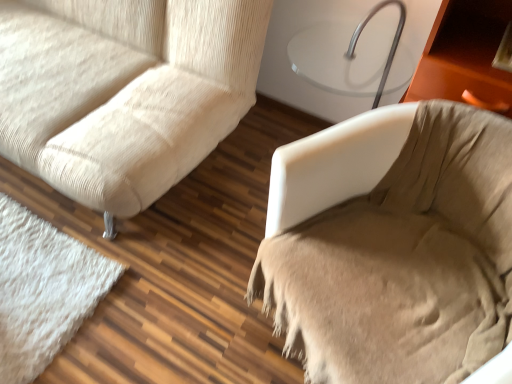
Locate an element on the screen. The height and width of the screenshot is (384, 512). beige fabric chair at right is located at coordinates (392, 245).

Describe the element at coordinates (392, 245) in the screenshot. The image size is (512, 384). I see `beige fabric chair at right` at that location.

Measure the distance between beige fabric chair at right and camera.

→ beige fabric chair at right and camera are 35.04 inches apart from each other.

Measure the distance between beige textured fabric couch at left and camera.

beige textured fabric couch at left and camera are 1.15 meters apart.

Identify the location of beige textured fabric couch at left. Image resolution: width=512 pixels, height=384 pixels. (124, 91).

What do you see at coordinates (124, 91) in the screenshot? The width and height of the screenshot is (512, 384). I see `beige textured fabric couch at left` at bounding box center [124, 91].

Locate an element on the screen. Image resolution: width=512 pixels, height=384 pixels. beige fabric chair at right is located at coordinates coord(392,245).

Which object is positioned more to the left, beige textured fabric couch at left or beige fabric chair at right?

beige textured fabric couch at left is more to the left.

Is the depth of beige textured fabric couch at left less than that of beige fabric chair at right?

No.

Which is closer to the camera, (23, 21) or (276, 320)?

The point (276, 320) is closer to the camera.

From the image's perspective, is beige textured fabric couch at left below beige fabric chair at right?

Incorrect, from the image's perspective, beige textured fabric couch at left is higher than beige fabric chair at right.

From a real-world perspective, which is physically above, beige textured fabric couch at left or beige fabric chair at right?

beige textured fabric couch at left, from a real-world perspective.

Consider the image. Between beige textured fabric couch at left and beige fabric chair at right, which one has smaller width?

→ Thinner between the two is beige fabric chair at right.

Does beige textured fabric couch at left have a lesser height compared to beige fabric chair at right?

No.

Can you confirm if beige textured fabric couch at left is smaller than beige fabric chair at right?

No, beige textured fabric couch at left is not smaller than beige fabric chair at right.

Do you think beige textured fabric couch at left is within beige fabric chair at right, or outside of it?

beige textured fabric couch at left is outside beige fabric chair at right.

Based on the photo, is beige textured fabric couch at left far from beige fabric chair at right?

No, beige textured fabric couch at left is not far away from beige fabric chair at right.

Is beige fabric chair at right at the back of beige textured fabric couch at left?

No, beige textured fabric couch at left is not facing away from beige fabric chair at right.

What are the coordinates of `furniture that appears below the beige textured fabric couch at left (from the image's perspective)` in the screenshot? It's located at (392, 245).

Which is more to the right, beige fabric chair at right or beige textured fabric couch at left?

From the viewer's perspective, beige fabric chair at right appears more on the right side.

Is beige fabric chair at right closer to the viewer compared to beige textured fabric couch at left?

Yes, beige fabric chair at right is in front of beige textured fabric couch at left.

Which is behind, point (497, 182) or point (14, 16)?

The point (14, 16) is behind.

From the image's perspective, is beige fabric chair at right below beige textured fabric couch at left?

Yes, from the image's perspective, beige fabric chair at right is below beige textured fabric couch at left.

From a real-world perspective, who is located higher, beige fabric chair at right or beige textured fabric couch at left?

beige textured fabric couch at left is physically above.

Which object is thinner, beige fabric chair at right or beige textured fabric couch at left?

beige fabric chair at right is thinner.

Who is shorter, beige fabric chair at right or beige textured fabric couch at left?

beige fabric chair at right is shorter.

Can you confirm if beige fabric chair at right is bigger than beige textured fabric couch at left?

No.

Is beige textured fabric couch at left a part of beige fabric chair at right?

No, beige textured fabric couch at left is not inside beige fabric chair at right.

Are beige fabric chair at right and beige textured fabric couch at left making contact?

No, beige fabric chair at right is not in contact with beige textured fabric couch at left.

Is beige fabric chair at right turned away from beige textured fabric couch at left?

No, beige textured fabric couch at left is not at the back of beige fabric chair at right.

The width and height of the screenshot is (512, 384). What are the coordinates of `furniture below the beige textured fabric couch at left (from the image's perspective)` in the screenshot? It's located at (392, 245).

Locate an element on the screen. This screenshot has height=384, width=512. furniture below the beige textured fabric couch at left (from a real-world perspective) is located at coordinates (392, 245).

Where is `studio couch that is behind the beige fabric chair at right`? studio couch that is behind the beige fabric chair at right is located at coordinates (124, 91).